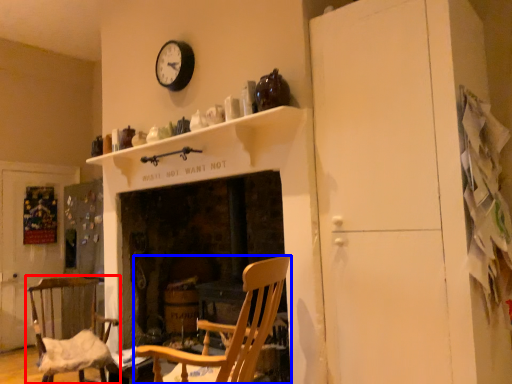
Question: Which object is further to the camera taking this photo, chair (highlighted by a red box) or chair (highlighted by a blue box)?

Choices:
 (A) chair
 (B) chair

Answer: (A)